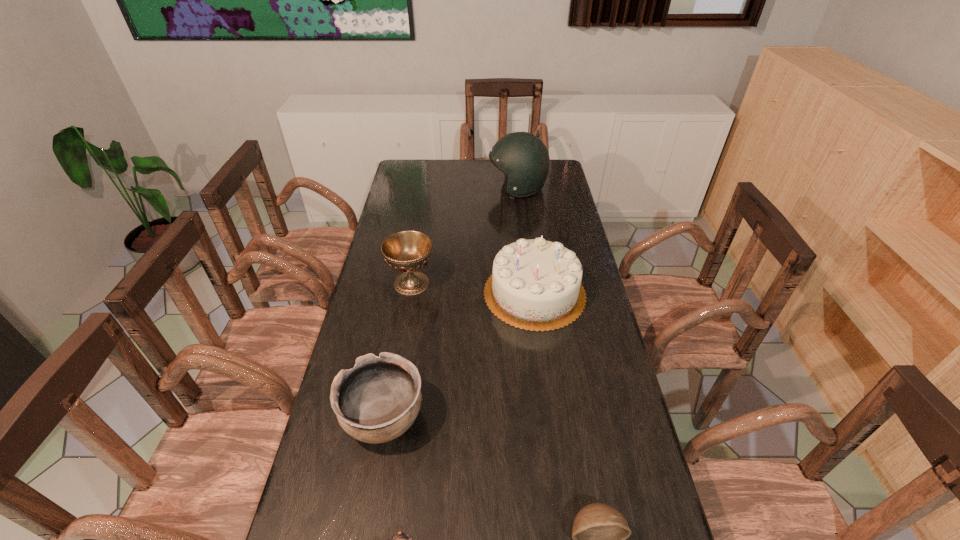
The width and height of the screenshot is (960, 540). What are the coordinates of `vacant space positioned 0.060m on the back of the pottery` in the screenshot? It's located at (394, 366).

Locate an element on the screen. This screenshot has height=540, width=960. object at the far edge is located at coordinates pos(523,157).

What are the coordinates of `chalice located in the left edge section of the desktop` in the screenshot? It's located at (407, 251).

Identify the location of pottery that is at the left edge. This screenshot has height=540, width=960. (376, 401).

At what (x,y) coordinates should I click in order to perform the action: click on football helmet present at the right edge. Please return your answer as a coordinate pair (x, y). Image resolution: width=960 pixels, height=540 pixels. Looking at the image, I should click on (523, 157).

The image size is (960, 540). Identify the location of birthday cake present at the right edge. (535, 285).

Locate an element on the screen. The height and width of the screenshot is (540, 960). object present at the far right corner is located at coordinates (523, 157).

The height and width of the screenshot is (540, 960). In order to click on vacant area at the left edge of the desktop in this screenshot , I will do `click(396, 272)`.

In the image, there is a desktop. Identify the location of vacant space at the right edge. The width and height of the screenshot is (960, 540). (581, 334).

Locate an element on the screen. This screenshot has width=960, height=540. vacant space at the far left corner of the desktop is located at coordinates (431, 161).